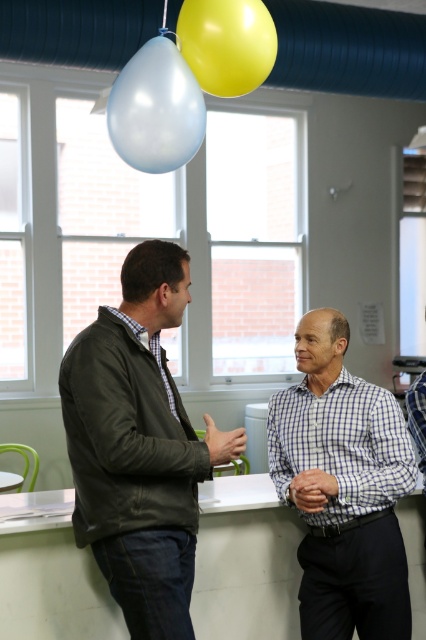
You are an interior designer planning to place a new artwork on the wall where the leather jacket at left is currently positioned. What are the exact coordinates where you should place the artwork to match the jacket?

Result: The artwork should be placed at coordinates [138,445] to match the position of the leather jacket at left.

You are a photographer trying to capture a candid shot of the two people in the scene. You want to ensure the yellow rubber balloon at upper center is visible in the background behind the person in the leather jacket at left. Based on their positions, is this possible?

The leather jacket at left is below the yellow rubber balloon at upper center, so yes, the photographer can position themselves to capture the yellow rubber balloon at upper center behind the person in the leather jacket at left since the balloon is above the jacket.